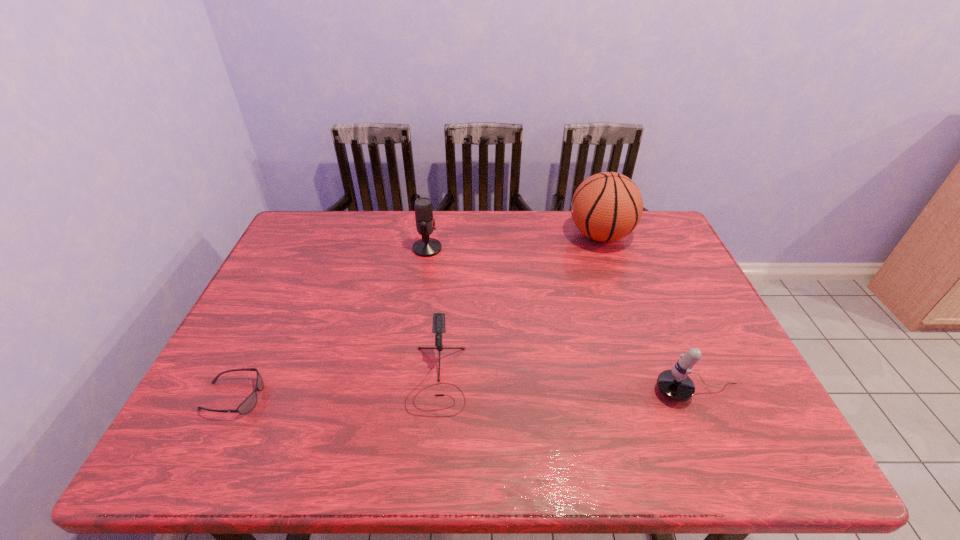
At what (x,y) coordinates should I click in order to perform the action: click on basketball. Please return your answer as a coordinate pair (x, y). Looking at the image, I should click on (607, 206).

What are the coordinates of `the tallest microphone` in the screenshot? It's located at (426, 247).

The image size is (960, 540). Find the location of `the farthest microphone`. the farthest microphone is located at coordinates (426, 247).

What are the coordinates of `the second shortest microphone` in the screenshot? It's located at (674, 384).

Identify the location of the third shortest object. (674, 384).

The width and height of the screenshot is (960, 540). Find the location of `the shortest microphone`. the shortest microphone is located at coordinates (438, 327).

Where is `the leftmost object`? the leftmost object is located at coordinates click(x=249, y=403).

Locate an element on the screen. The height and width of the screenshot is (540, 960). the shortest object is located at coordinates (249, 403).

Identify the location of free location located 0.110m on the side where the inflation valve is located. This screenshot has width=960, height=540. (534, 235).

The image size is (960, 540). I want to click on vacant space located 0.370m on the side where the inflation valve is located, so click(x=456, y=235).